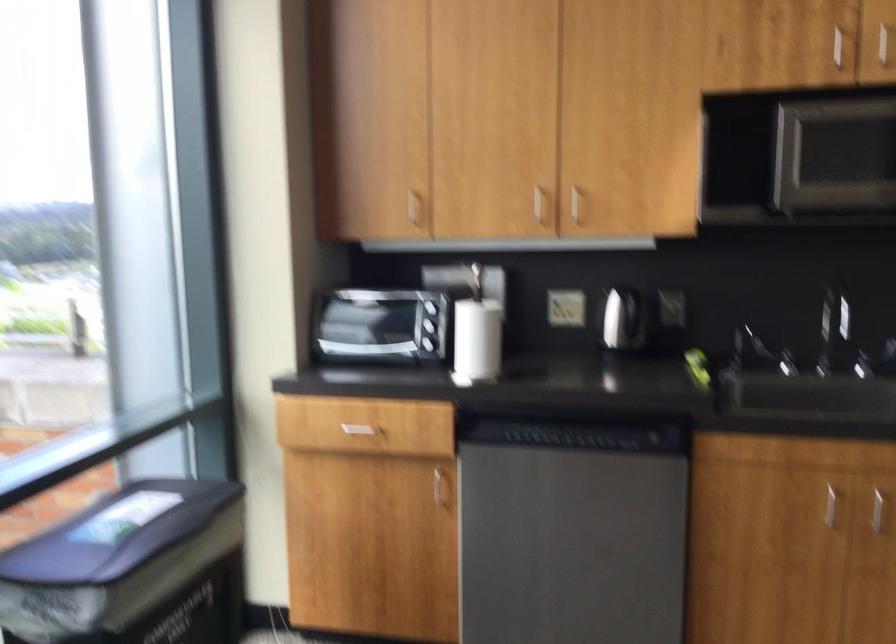
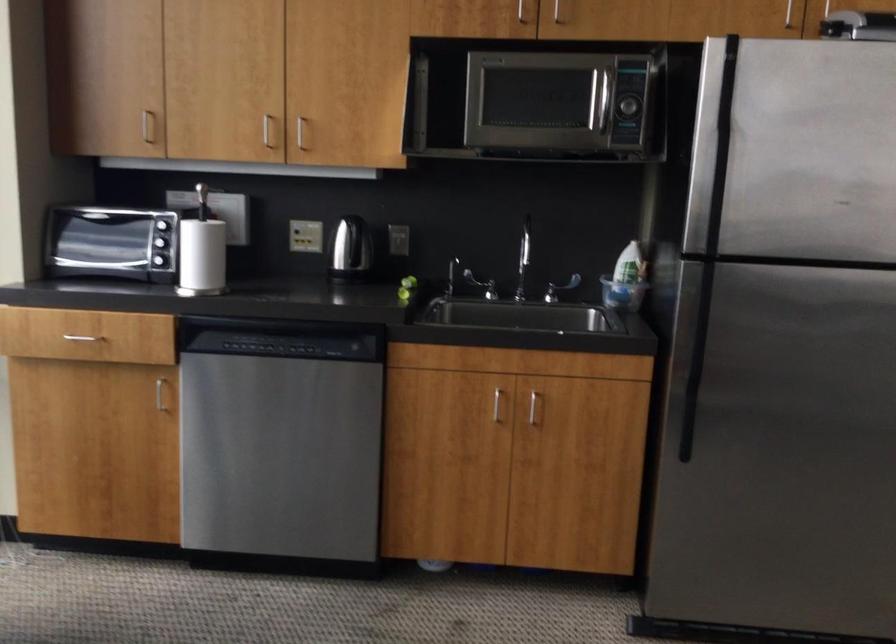
Where in the second image is the point corresponding to point 359,431 from the first image?

(82, 337)